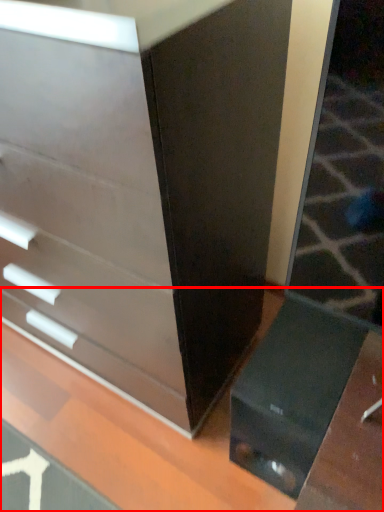
Question: Considering the relative positions of table (annotated by the red box) and chest of drawers in the image provided, where is table (annotated by the red box) located with respect to the staircase?

Choices:
 (A) right
 (B) left

Answer: (A)